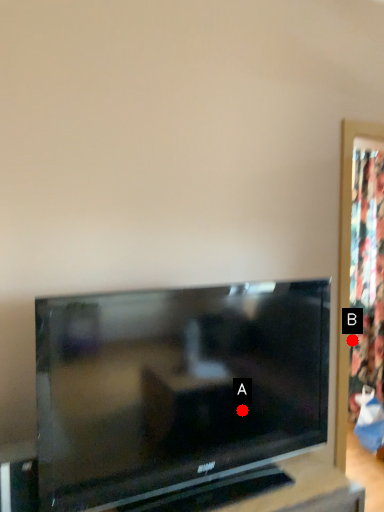
Question: Two points are circled on the image, labeled by A and B beside each circle. Among these points, which one is farthest from the camera?

Choices:
 (A) A is further
 (B) B is further

Answer: (B)